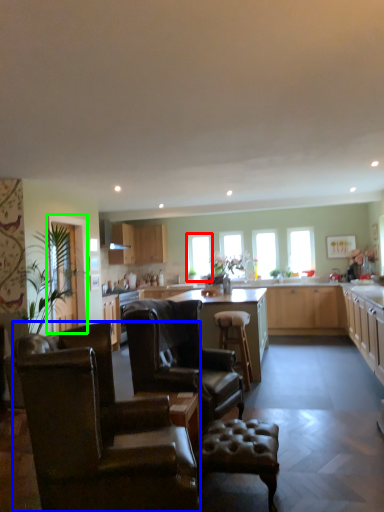
Question: Based on their relative distances, which object is farther from window (highlighted by a red box)? Choose from chair (highlighted by a blue box) and glass door (highlighted by a green box).

Choices:
 (A) chair
 (B) glass door

Answer: (A)